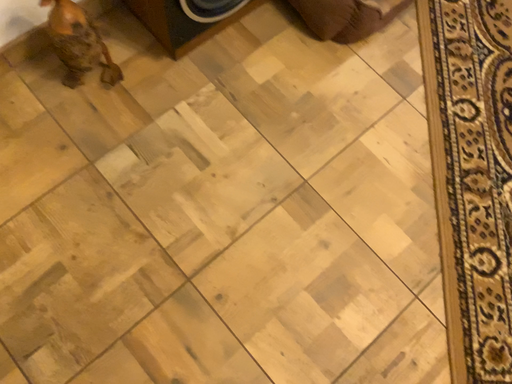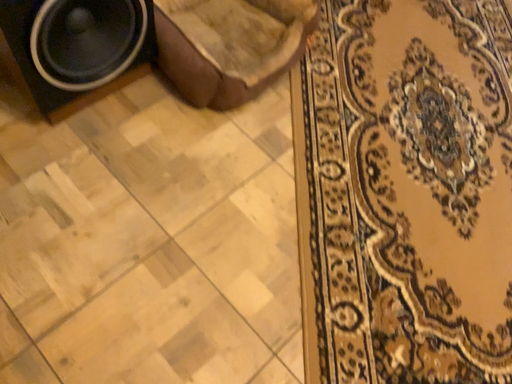
Question: How did the camera likely rotate when shooting the video?

Choices:
 (A) rotated upward
 (B) rotated downward

Answer: (A)